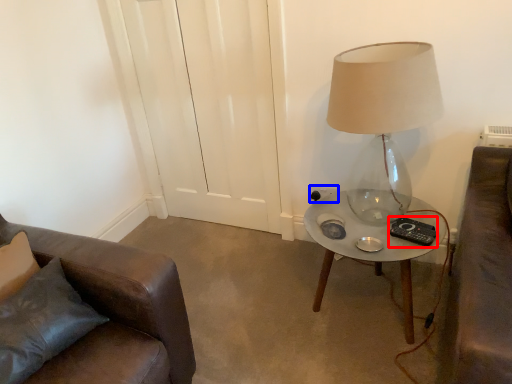
Question: Which object is further to the camera taking this photo, remote control (highlighted by a red box) or electric outlet (highlighted by a blue box)?

Choices:
 (A) remote control
 (B) electric outlet

Answer: (B)